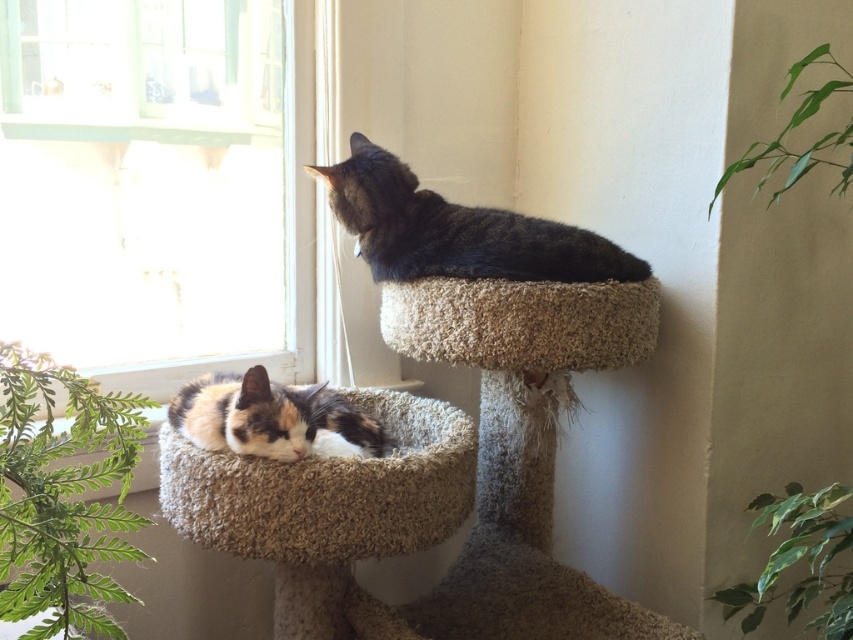
Question: Can you confirm if clear glass window at upper left is bigger than beige carpeted cat bed at upper center?

Choices:
 (A) no
 (B) yes

Answer: (A)

Question: Estimate the real-world distances between objects in this image. Which object is farther from the beige carpeted cat bed at upper center?

Choices:
 (A) dark brown fur cat at upper right
 (B) calico fur cat at lower left
 (C) clear glass window at upper left
 (D) beige carpeted cat bed at lower left

Answer: (C)

Question: Which of the following is the farthest from the observer?

Choices:
 (A) dark brown fur cat at upper right
 (B) clear glass window at upper left
 (C) calico fur cat at lower left

Answer: (B)

Question: Can you confirm if clear glass window at upper left is positioned to the right of beige carpeted cat bed at lower left?

Choices:
 (A) no
 (B) yes

Answer: (A)

Question: Based on their relative distances, which object is farther from the clear glass window at upper left?

Choices:
 (A) beige carpeted cat bed at lower left
 (B) calico fur cat at lower left
 (C) dark brown fur cat at upper right

Answer: (A)

Question: Can you confirm if clear glass window at upper left is smaller than beige carpeted cat bed at lower left?

Choices:
 (A) yes
 (B) no

Answer: (B)